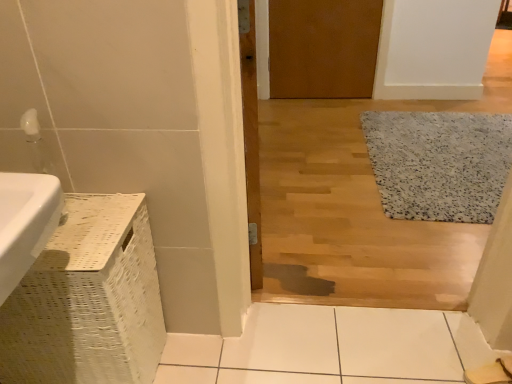
Question: Does white speckled rug at right have a greater width compared to wooden door at center, the 2th door viewed from the right?

Choices:
 (A) yes
 (B) no

Answer: (A)

Question: Is white speckled rug at right smaller than wooden door at center, the 2th door viewed from the right?

Choices:
 (A) no
 (B) yes

Answer: (A)

Question: From the image's perspective, is white speckled rug at right below wooden door at center, which is the 2th door in top-to-bottom order?

Choices:
 (A) yes
 (B) no

Answer: (B)

Question: Considering the relative sizes of white speckled rug at right and wooden door at center, acting as the first door starting from the left, in the image provided, is white speckled rug at right bigger than wooden door at center, acting as the first door starting from the left,?

Choices:
 (A) no
 (B) yes

Answer: (B)

Question: Is the depth of white speckled rug at right greater than that of wooden door at center, positioned as the 2th door in back-to-front order?

Choices:
 (A) yes
 (B) no

Answer: (A)

Question: Looking at the image, does white speckled rug at right seem bigger or smaller compared to brown matte door at upper center, the 1th door positioned from the right?

Choices:
 (A) big
 (B) small

Answer: (A)

Question: In terms of width, does white speckled rug at right look wider or thinner when compared to brown matte door at upper center, marked as the second door in a left-to-right arrangement?

Choices:
 (A) thin
 (B) wide

Answer: (B)

Question: Visually, is white speckled rug at right positioned to the left or to the right of brown matte door at upper center, marked as the second door in a left-to-right arrangement?

Choices:
 (A) left
 (B) right

Answer: (B)

Question: Is white speckled rug at right spatially inside brown matte door at upper center, the 1th door positioned from the right, or outside of it?

Choices:
 (A) inside
 (B) outside

Answer: (B)

Question: Does point (352, 74) appear closer or farther from the camera than point (243, 115)?

Choices:
 (A) farther
 (B) closer

Answer: (A)

Question: From the image's perspective, is brown matte door at upper center, the 1th door positioned from the right, above or below wooden door at center, which is the 1th door in bottom-to-top order?

Choices:
 (A) below
 (B) above

Answer: (B)

Question: Considering the positions of brown matte door at upper center, the 1th door positioned from the right, and wooden door at center, which is the 1th door from front to back, in the image, is brown matte door at upper center, the 1th door positioned from the right, wider or thinner than wooden door at center, which is the 1th door from front to back,?

Choices:
 (A) thin
 (B) wide

Answer: (A)

Question: Is brown matte door at upper center, the first door positioned from the back, bigger or smaller than wooden door at center, which is the 2th door in top-to-bottom order?

Choices:
 (A) small
 (B) big

Answer: (B)

Question: From a real-world perspective, is wooden door at center, which is the 1th door in bottom-to-top order, physically located above or below brown matte door at upper center, the first door positioned from the back?

Choices:
 (A) above
 (B) below

Answer: (A)

Question: Is point (245, 130) positioned closer to the camera than point (283, 1)?

Choices:
 (A) closer
 (B) farther

Answer: (A)